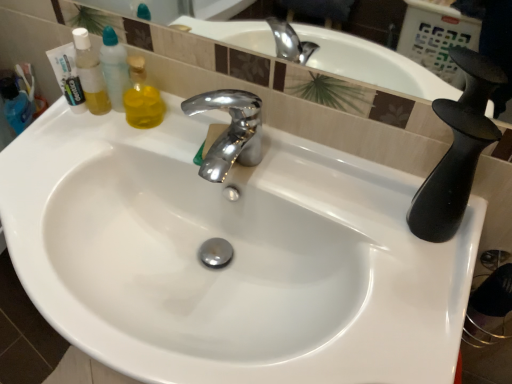
Question: Is point (249, 99) closer or farther from the camera than point (91, 74)?

Choices:
 (A) closer
 (B) farther

Answer: (A)

Question: Is polished chrome faucet at center to the left or to the right of translucent plastic mouthwash at left in the image?

Choices:
 (A) right
 (B) left

Answer: (A)

Question: Considering the real-world distances, which object is closest to the white glossy sink at center?

Choices:
 (A) polished chrome faucet at center
 (B) translucent plastic mouthwash at left

Answer: (A)

Question: Considering the real-world distances, which object is farthest from the polished chrome faucet at center?

Choices:
 (A) white glossy sink at center
 (B) translucent plastic mouthwash at left

Answer: (B)